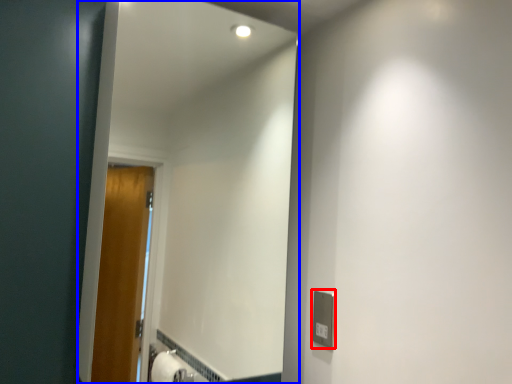
Question: Which object is closer to the camera taking this photo, electric outlet (highlighted by a red box) or mirror (highlighted by a blue box)?

Choices:
 (A) electric outlet
 (B) mirror

Answer: (B)